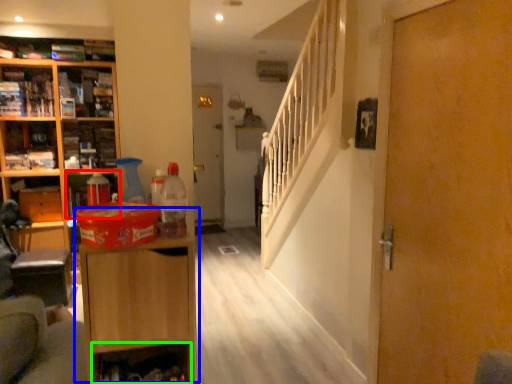
Question: Which object is positioned closest to cabinet (highlighted by a red box)? Select from cabinetry (highlighted by a blue box) and shelf (highlighted by a green box).

Choices:
 (A) cabinetry
 (B) shelf

Answer: (B)